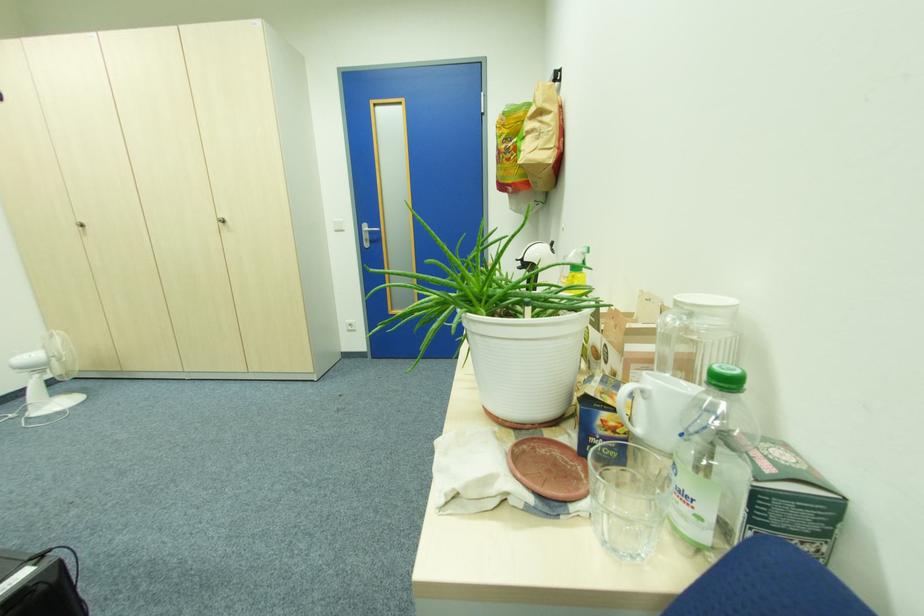
Find the location of a particular element. The height and width of the screenshot is (616, 924). silver door handle is located at coordinates (368, 228).